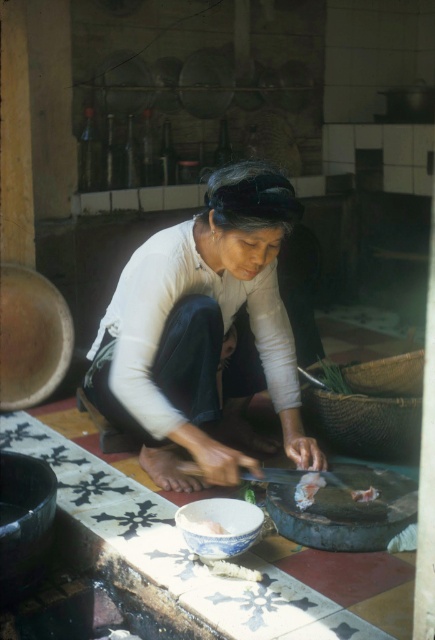
You are a chef preparing sushi rolls and need to place both the white matte fabric at center and the white soft food at center onto a plate. Which object should you place first to ensure proper layering according to their sizes?

The white matte fabric at center should be placed first because it has a larger size compared to the white soft food at center, allowing the smaller item to be layered on top.

You are standing in the kitchen and see the white matte fabric at center. If you want to reach it without moving your feet, can you do it?

The white matte fabric at center is 2.15 meters away from the viewer, so you cannot reach it without moving your feet since it is too far.